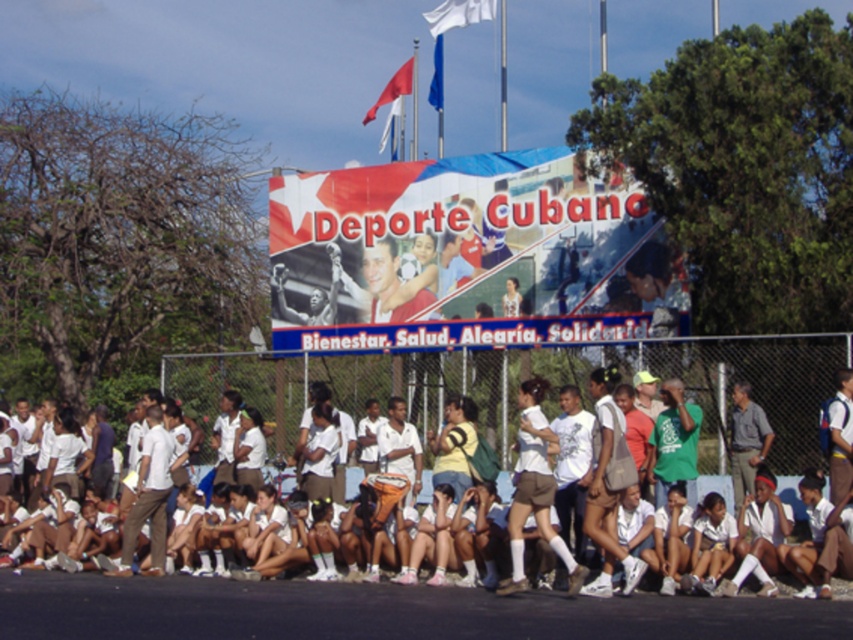
You are standing at the center of the scene and want to find the white cotton shirt at center. According to the coordinates provided, in which direction should you look to locate it?

The white cotton shirt at center is located at coordinates point (796, 396). Since the coordinate system typically has (0, 0) at the bottom left corner, 0.620 on the x axis would be to the right of center, and 0.934 on the y axis would be near the bottom of the image. Therefore, you should look to the lower right direction from the center to locate the white cotton shirt at center.

You are standing in front of the large banner at the event. There are two points marked in the scene, one at coordinates point (x=677, y=474) and another at point (x=753, y=410). Which point is closer to you?

Point (x=677, y=474) is closer to the viewer than point (x=753, y=410).